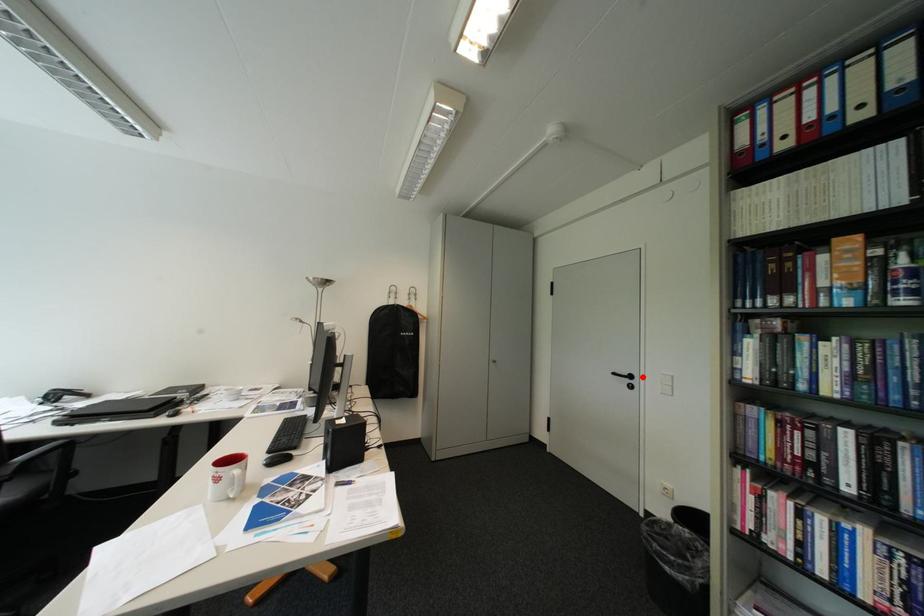
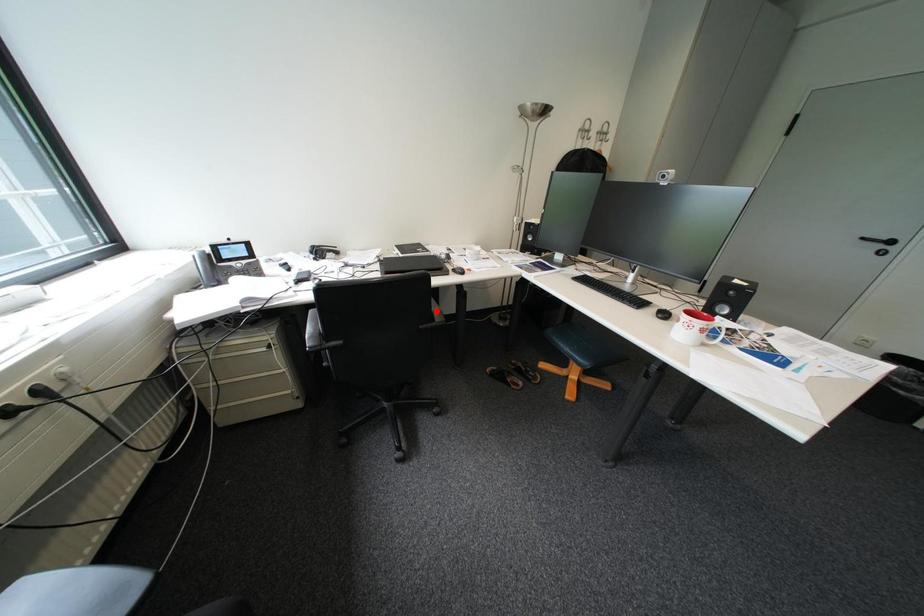
Looking at this image, I am providing you with two images of the same scene from different viewpoints. A red point is marked on the first image and another point is marked on the second image. Is the marked point in image1 the same physical position as the marked point in image2?

No